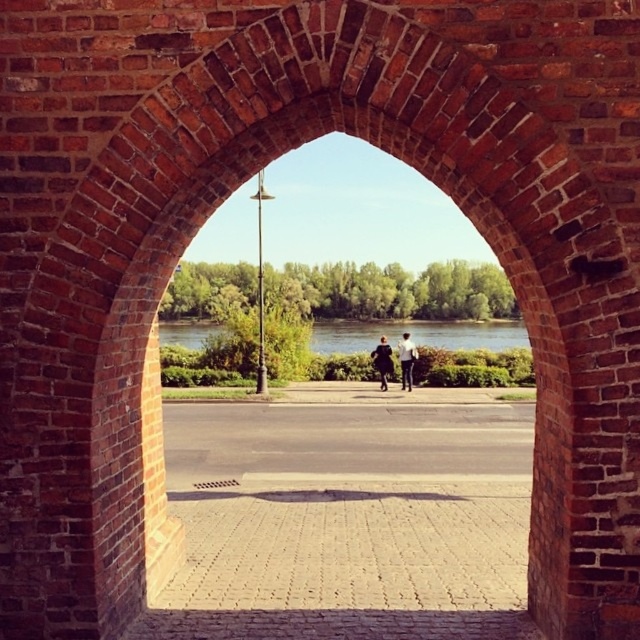
Question: Which point is closer to the camera?

Choices:
 (A) light blue jeans at center
 (B) dark blue fabric jacket at center
 (C) dark gray fabric coat at center

Answer: (B)

Question: Which point appears farthest from the camera in this image?

Choices:
 (A) (397, 348)
 (B) (401, 346)

Answer: (A)

Question: Is light blue jeans at center positioned before dark blue fabric jacket at center?

Choices:
 (A) yes
 (B) no

Answer: (B)

Question: Which object is farther from the camera taking this photo?

Choices:
 (A) dark gray fabric coat at center
 (B) dark blue fabric jacket at center
 (C) light blue jeans at center

Answer: (A)

Question: Can you confirm if dark gray fabric coat at center is smaller than dark blue fabric jacket at center?

Choices:
 (A) no
 (B) yes

Answer: (A)

Question: Can you confirm if dark gray fabric coat at center is positioned to the right of dark blue fabric jacket at center?

Choices:
 (A) yes
 (B) no

Answer: (B)